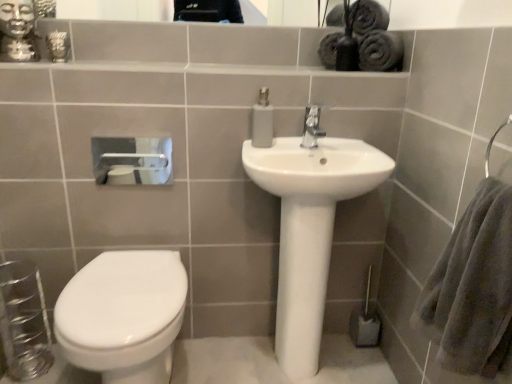
Locate an element on the screen. free spot to the right of silver metallic faucet at center is located at coordinates (344, 142).